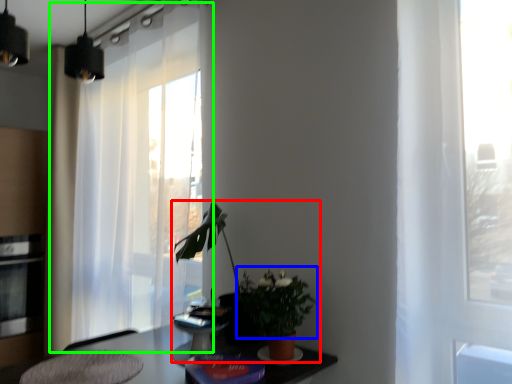
Question: Which object is the closest to the houseplant (highlighted by a red box)? Choose among these: floral arrangement (highlighted by a blue box) or curtain (highlighted by a green box).

Choices:
 (A) floral arrangement
 (B) curtain

Answer: (A)